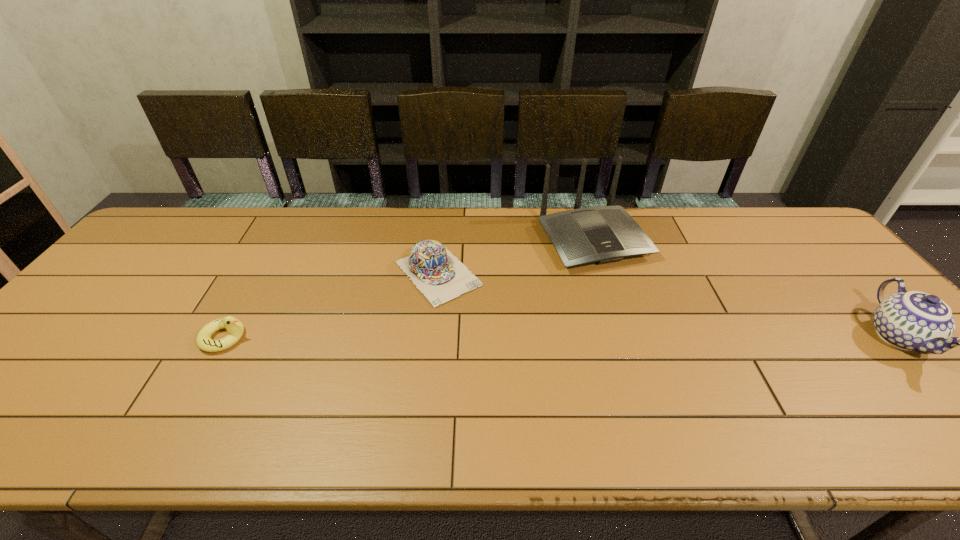
At what (x,y) coordinates should I click in order to perform the action: click on vacant area between the router and the second object from left to right. Please return your answer as a coordinate pair (x, y). The image size is (960, 540). Looking at the image, I should click on (516, 256).

Locate an element on the screen. This screenshot has height=540, width=960. vacant point located between the router and the duckling is located at coordinates (409, 289).

Locate an element on the screen. This screenshot has height=540, width=960. vacant area that lies between the second object from left to right and the router is located at coordinates (516, 256).

Image resolution: width=960 pixels, height=540 pixels. I want to click on vacant region between the tallest object and the cap, so click(x=516, y=256).

Locate an element on the screen. This screenshot has width=960, height=540. the second closest object to the duckling is located at coordinates (604, 234).

The height and width of the screenshot is (540, 960). What are the coordinates of `the third closest object to the third object from left to right` in the screenshot? It's located at (235, 328).

This screenshot has height=540, width=960. Find the location of `vacant space that satisfies the following two spatial constraints: 1. on the back side of the tallest object; 2. on the right side of the cap`. vacant space that satisfies the following two spatial constraints: 1. on the back side of the tallest object; 2. on the right side of the cap is located at coordinates (442, 240).